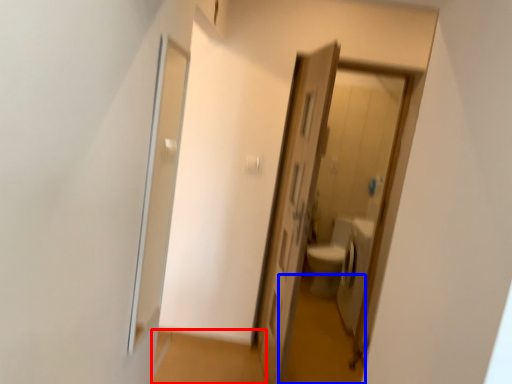
Question: Among these objects, which one is farthest to the camera, path (highlighted by a red box) or path (highlighted by a blue box)?

Choices:
 (A) path
 (B) path

Answer: (B)